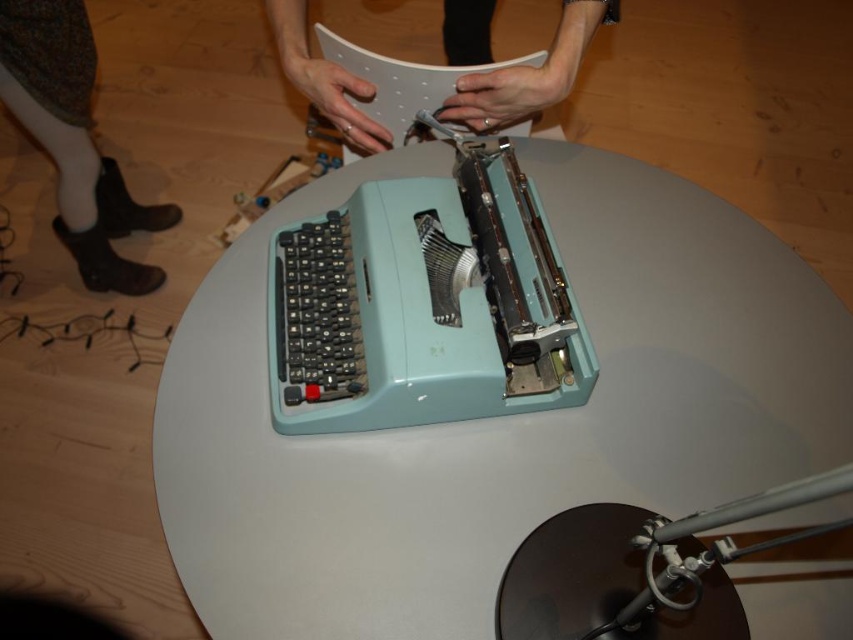
Between point (260, 477) and point (80, 61), which one is positioned behind?

Point (80, 61)

You are a GUI agent. You are given a task and a screenshot of the screen. Output one action in this format:
    pyautogui.click(x=<x>, y=<y>)
    Task: Click on the light blue plastic typewriter at center
    This screenshot has width=853, height=640.
    Given the screenshot: What is the action you would take?
    pyautogui.click(x=495, y=419)

You are a GUI agent. You are given a task and a screenshot of the screen. Output one action in this format:
    pyautogui.click(x=<x>, y=<y>)
    Task: Click on the light blue plastic typewriter at center
    
    Given the screenshot: What is the action you would take?
    pyautogui.click(x=495, y=419)

The image size is (853, 640). In order to click on light blue plastic typewriter at center in this screenshot , I will do `click(495, 419)`.

Can you confirm if floral-patterned skirt at lower left is positioned to the left of matte white paper at center?

Correct, you'll find floral-patterned skirt at lower left to the left of matte white paper at center.

Who is more distant from viewer, (144, 273) or (466, 19)?

The point (144, 273) is more distant.

Where is `floral-patterned skirt at lower left`? The image size is (853, 640). floral-patterned skirt at lower left is located at coordinates (74, 140).

Measure the distance between point (706, 310) and camera.

Point (706, 310) and camera are 36.75 inches apart from each other.

Can you confirm if light blue plastic typewriter at center is taller than matte white paper at center?

Indeed, light blue plastic typewriter at center has a greater height compared to matte white paper at center.

Is point (590, 481) in front of point (344, 125)?

Yes.

Identify the location of light blue plastic typewriter at center. Image resolution: width=853 pixels, height=640 pixels. (495, 419).